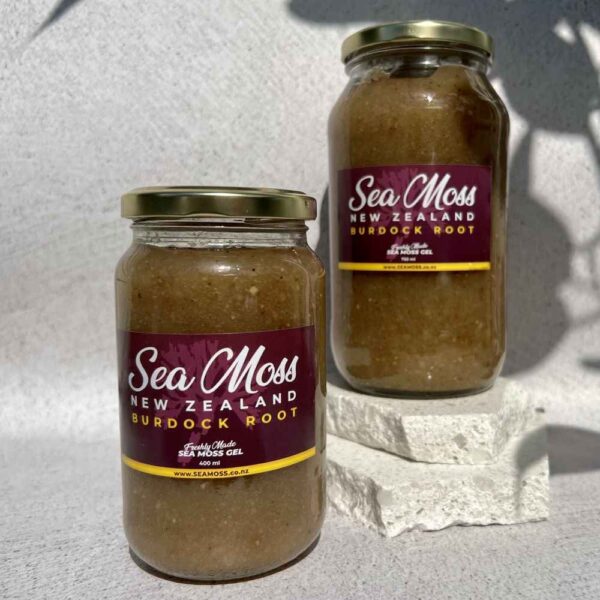
Find the location of a particular element. The height and width of the screenshot is (600, 600). floor is located at coordinates [451, 570].